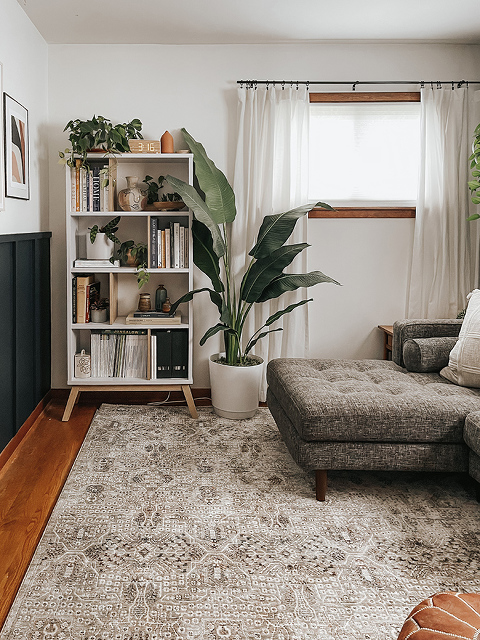
I want to click on wooden floor, so click(58, 440), click(22, 518), click(8, 560).